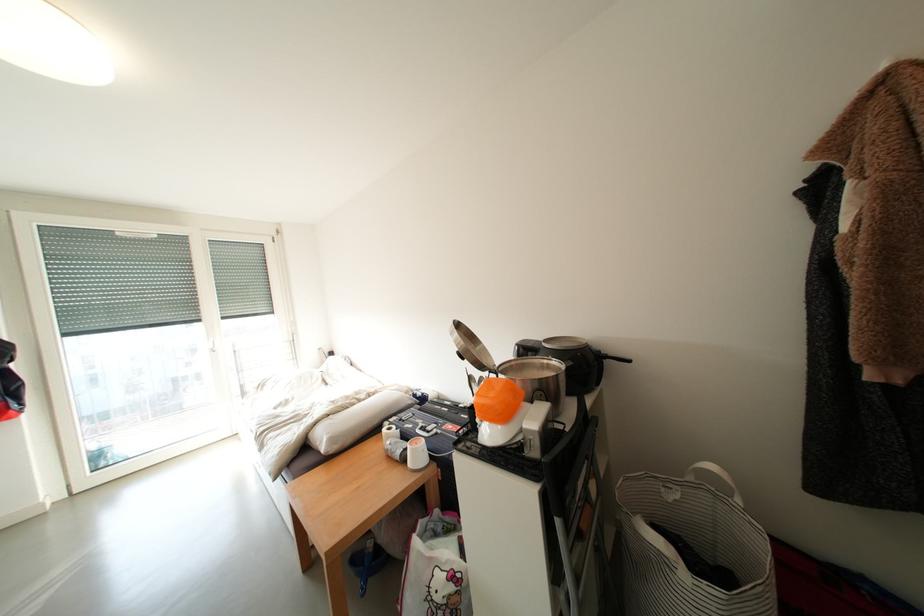
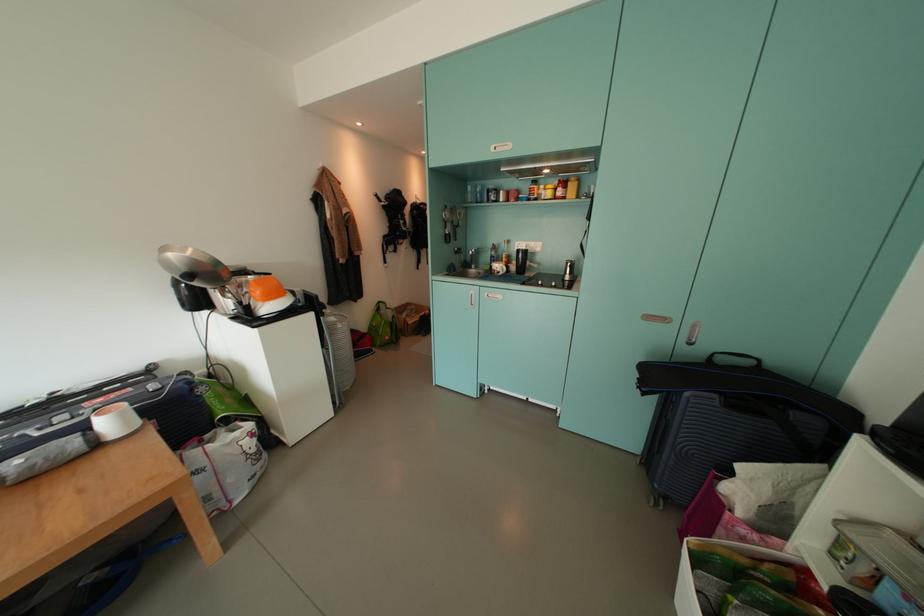
Locate, in the second image, the point that corresponds to point (424, 456) in the first image.

(123, 426)